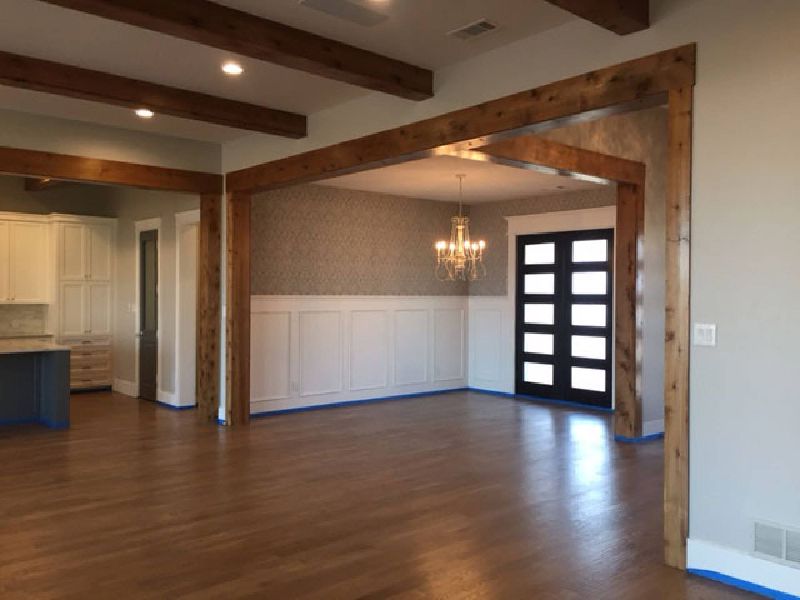
Where is `door`? The width and height of the screenshot is (800, 600). door is located at coordinates (562, 361).